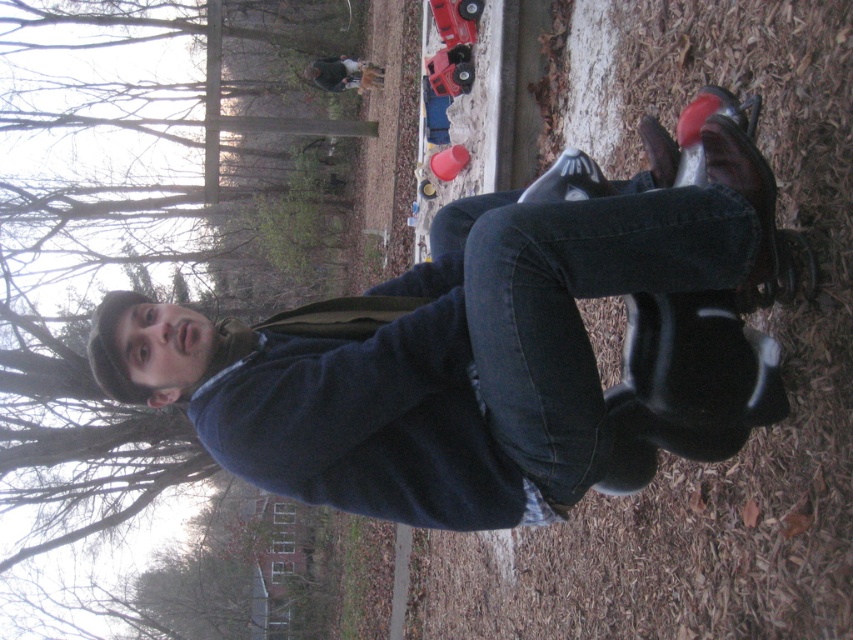
Question: Can you confirm if matte black skateboard at center is positioned to the left of denim at center?

Choices:
 (A) yes
 (B) no

Answer: (A)

Question: Where is matte black skateboard at center located in relation to matte black shoe at lower center in the image?

Choices:
 (A) above
 (B) below

Answer: (B)

Question: Which of these objects is positioned closest to the matte black shoe at lower center?

Choices:
 (A) matte black shoe at center
 (B) denim at center
 (C) black rubber shoe at lower center
 (D) matte black skateboard at center

Answer: (A)

Question: Which point is closer to the camera?

Choices:
 (A) (637, 372)
 (B) (643, 147)
 (C) (538, 189)

Answer: (A)

Question: Is matte black skateboard at center below black leather shoe at lower right?

Choices:
 (A) no
 (B) yes

Answer: (B)

Question: Which object is closer to the camera taking this photo?

Choices:
 (A) matte black shoe at center
 (B) matte black skateboard at center
 (C) black rubber shoe at lower center

Answer: (B)